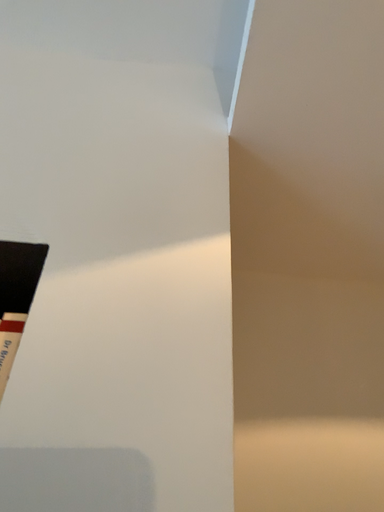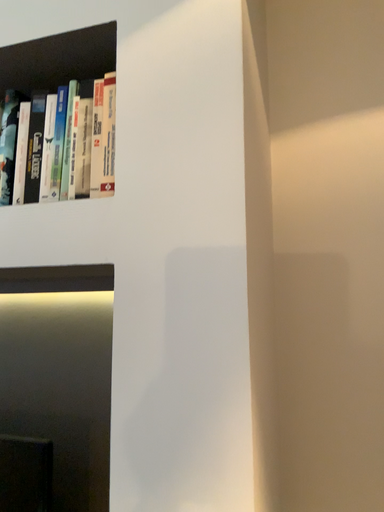
Question: How did the camera likely rotate when shooting the video?

Choices:
 (A) rotated upward
 (B) rotated downward

Answer: (B)